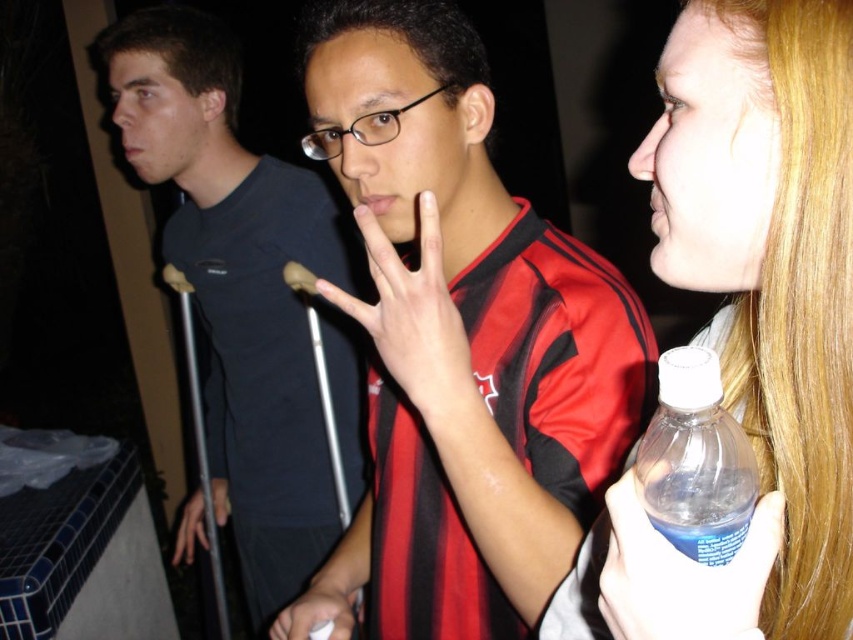
Is matte black shirt at center closer to camera compared to matte black hand at center?

No, it is not.

Who is more distant from viewer, (398, 464) or (422, 333)?

Positioned behind is point (398, 464).

Identify the location of matte black shirt at center. (463, 337).

Is matte black shirt at center to the left of dark blue t-shirt at left from the viewer's perspective?

Incorrect, matte black shirt at center is not on the left side of dark blue t-shirt at left.

The image size is (853, 640). Find the location of `matte black shirt at center`. matte black shirt at center is located at coordinates (463, 337).

Is point (483, 515) farther from viewer compared to point (173, 252)?

No, it is in front of (173, 252).

This screenshot has width=853, height=640. In order to click on matte black shirt at center in this screenshot , I will do `click(463, 337)`.

How much distance is there between matte black shirt at center and metal crutches at center?

The distance of matte black shirt at center from metal crutches at center is 38.19 inches.

Is matte black shirt at center above metal crutches at center?

Yes.

The height and width of the screenshot is (640, 853). What do you see at coordinates (463, 337) in the screenshot?
I see `matte black shirt at center` at bounding box center [463, 337].

This screenshot has height=640, width=853. Identify the location of matte black shirt at center. (463, 337).